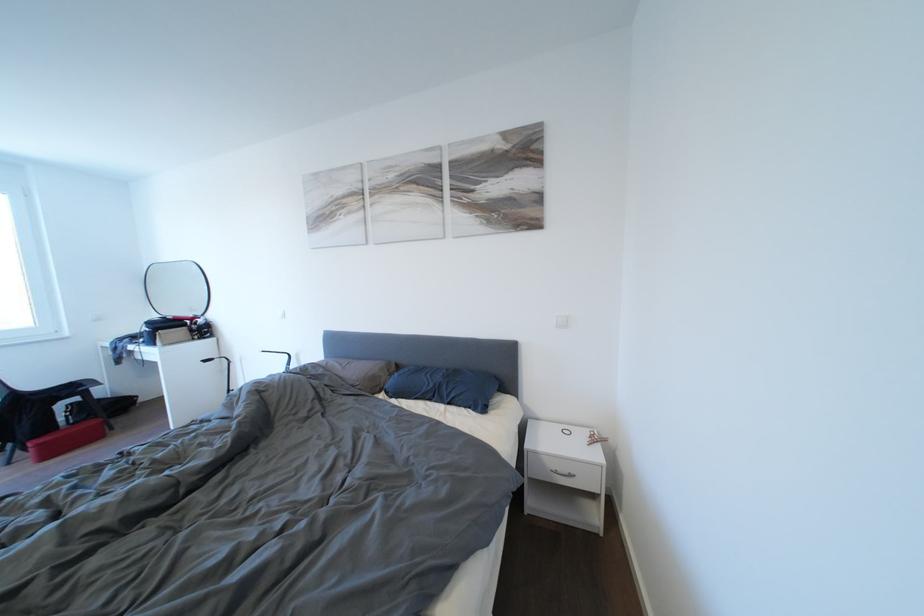
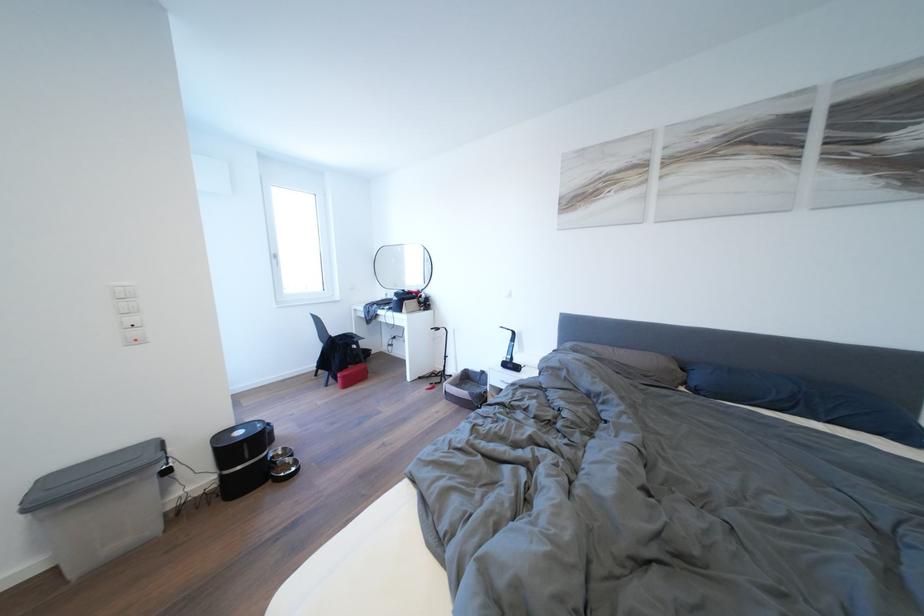
The point at (329, 376) is marked in the first image. Where is the corresponding point in the second image?

(602, 360)